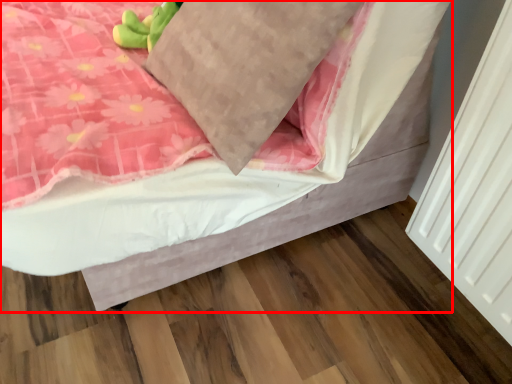
Question: From the image's perspective, where is bed (annotated by the red box) located relative to pillow?

Choices:
 (A) below
 (B) above

Answer: (B)